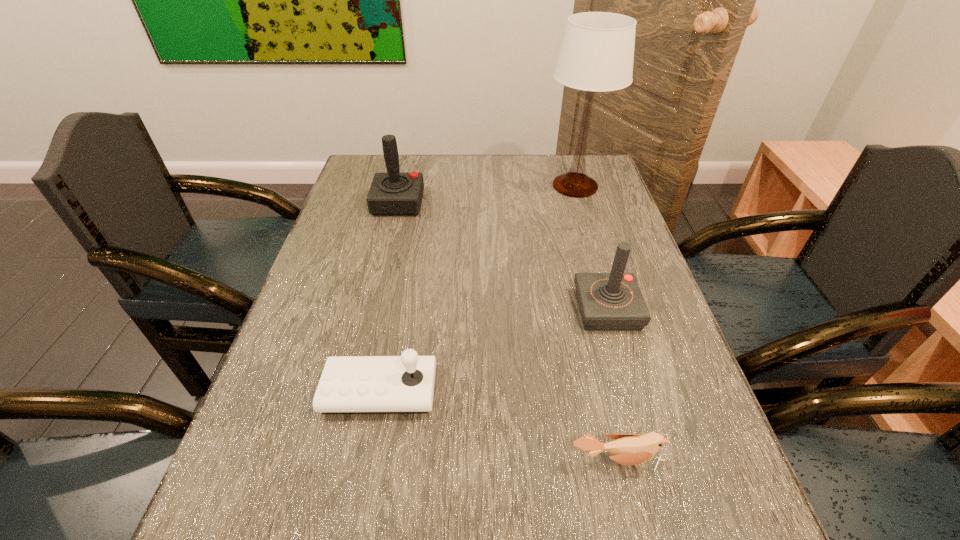
Where is `table lamp`? table lamp is located at coordinates (597, 52).

This screenshot has height=540, width=960. What are the coordinates of `the farthest joystick` in the screenshot? It's located at (393, 193).

Find the location of a particular element. The image size is (960, 540). the rightmost joystick is located at coordinates (613, 301).

You are a GUI agent. You are given a task and a screenshot of the screen. Output one action in this format:
    pyautogui.click(x=<x>, y=<y>)
    Task: Click on the third farthest object
    The image size is (960, 540).
    Given the screenshot: What is the action you would take?
    pyautogui.click(x=613, y=301)

Identify the location of the fourth farthest object. This screenshot has height=540, width=960. (404, 384).

Locate an element on the screen. Image resolution: width=960 pixels, height=540 pixels. the shortest joystick is located at coordinates tap(404, 384).

Identify the location of the nearest object. (627, 449).

Where is `bird`? bird is located at coordinates pos(627,449).

Image resolution: width=960 pixels, height=540 pixels. I want to click on free space located above the cylindrical shade of the tallest object, so click(433, 186).

This screenshot has height=540, width=960. Identify the location of free space located 0.290m above the cylindrical shade of the tallest object. (451, 186).